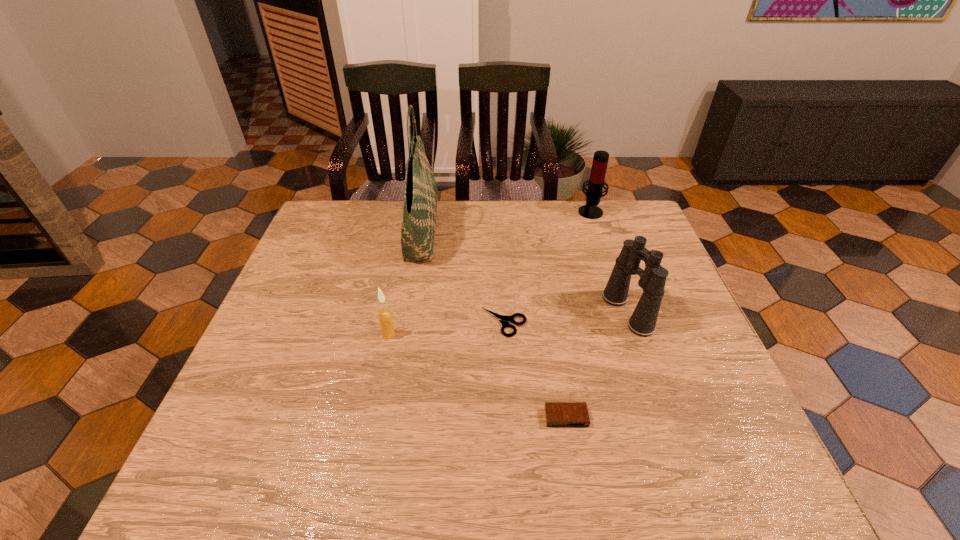
The image size is (960, 540). I want to click on free space at the near edge of the desktop, so click(x=678, y=476).

The image size is (960, 540). In the image, there is a desktop. Identify the location of free space at the left edge. (266, 391).

Find the location of a particular element. This screenshot has width=960, height=540. free space at the right edge of the desktop is located at coordinates (691, 420).

This screenshot has height=540, width=960. In the image, there is a desktop. Find the location of `vacant space at the far left corner`. vacant space at the far left corner is located at coordinates (342, 227).

You are a GUI agent. You are given a task and a screenshot of the screen. Output one action in this format:
    pyautogui.click(x=<x>, y=<y>)
    Task: Click on the free point between the microphone and the fourth object from left to right
    The height and width of the screenshot is (540, 960).
    Given the screenshot: What is the action you would take?
    pyautogui.click(x=578, y=314)

Find the location of a particular element. empty space between the binoculars and the alarm clock is located at coordinates (597, 364).

Locate an element on the screen. free space between the alarm clock and the tote bag is located at coordinates (493, 325).

Identify the location of free space that is in between the tallest object and the candle. The width and height of the screenshot is (960, 540). (405, 283).

The image size is (960, 540). In order to click on unoccupied position between the third shortest object and the tote bag in this screenshot , I will do `click(405, 283)`.

This screenshot has height=540, width=960. What are the coordinates of `unoccupied position between the microphone and the tallest object` in the screenshot? It's located at (506, 221).